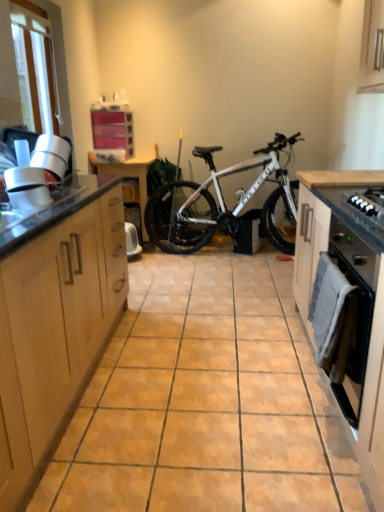
Locate an element on the screen. The width and height of the screenshot is (384, 512). free space in front of white matte bicycle at center is located at coordinates (223, 286).